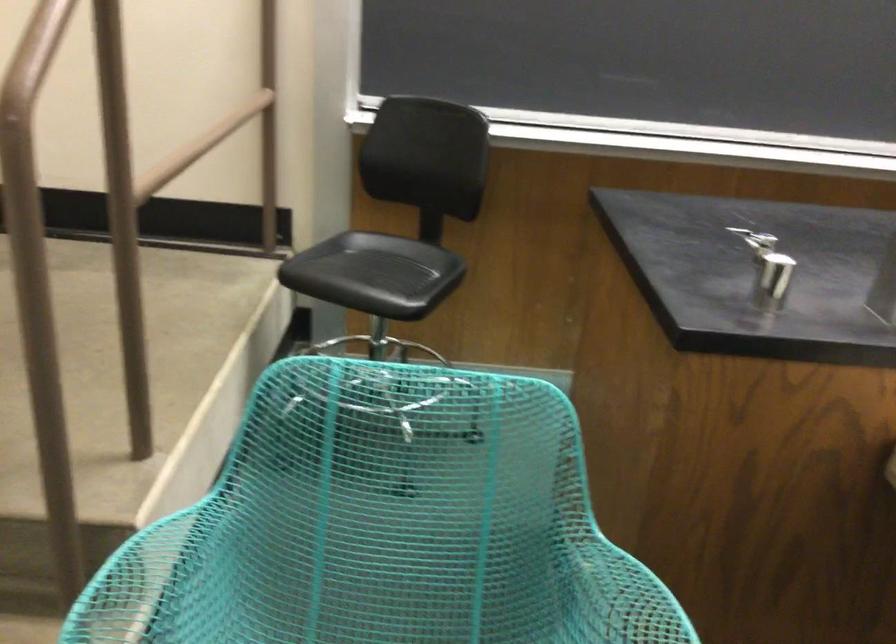
Locate an element on the screen. Image resolution: width=896 pixels, height=644 pixels. black chair sitting surface is located at coordinates (380, 270).